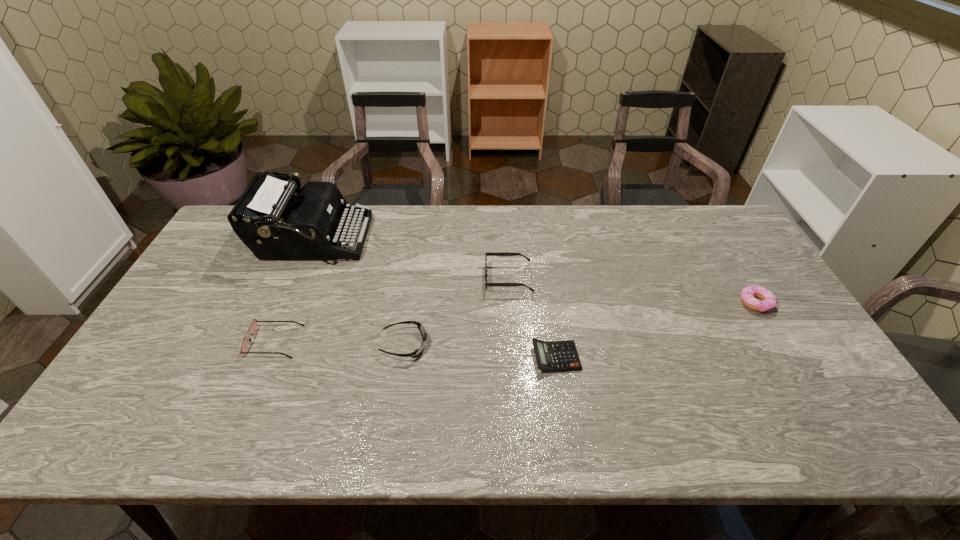
Find the location of a particular element. free space located at the front lenses of the rightmost sunglasses is located at coordinates (378, 278).

Locate an element on the screen. The image size is (960, 540). vacant region located 0.370m at the front lenses of the rightmost sunglasses is located at coordinates (365, 278).

Where is `free space located on the bridge of the leftmost sunglasses`? This screenshot has height=540, width=960. free space located on the bridge of the leftmost sunglasses is located at coordinates (419, 341).

This screenshot has width=960, height=540. In order to click on vacant space situated 0.100m on the back of the doughnut in this screenshot , I will do `click(734, 268)`.

What are the coordinates of `vacant space situated on the lenses of the shortest sunglasses` in the screenshot? It's located at (525, 345).

Locate an element on the screen. Image resolution: width=960 pixels, height=540 pixels. blank space located 0.090m on the right of the shortest object is located at coordinates (613, 357).

Locate an element on the screen. object that is positioned at the far edge is located at coordinates (x=270, y=220).

You are a GUI agent. You are given a task and a screenshot of the screen. Output one action in this format:
    pyautogui.click(x=<x>, y=<y>)
    Task: Click on the object located at the left edge
    This screenshot has height=540, width=960.
    Given the screenshot: What is the action you would take?
    pyautogui.click(x=270, y=220)

The image size is (960, 540). Find the location of `object located in the right edge section of the desktop`. object located in the right edge section of the desktop is located at coordinates (768, 300).

The height and width of the screenshot is (540, 960). I want to click on object that is at the far left corner, so click(x=270, y=220).